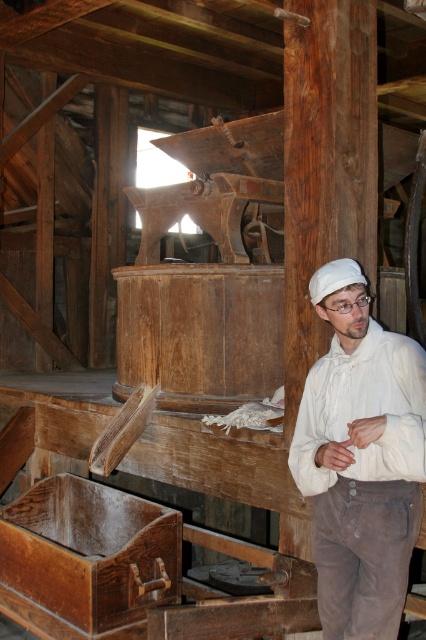
You are an inspector in the mill and need to access the controls on the large wooden machine. You see the white cotton shirt at center and the wooden crate at lower left. Which object is closer to the machine?

The white cotton shirt at center is closer to the large wooden machine because it is positioned to the right of the wooden crate at lower left, which is farther away.